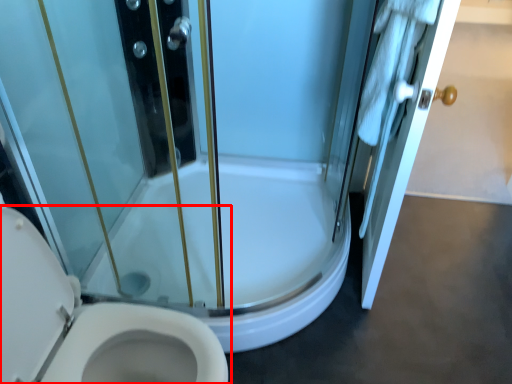
Question: In this image, where is toilet (annotated by the red box) located relative to door?

Choices:
 (A) left
 (B) right

Answer: (A)